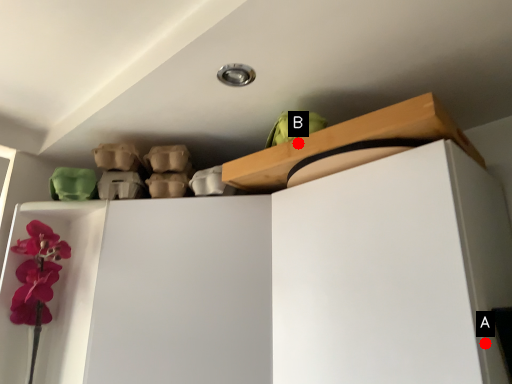
Question: Two points are circled on the image, labeled by A and B beside each circle. Among these points, which one is farthest from the camera?

Choices:
 (A) A is further
 (B) B is further

Answer: (B)